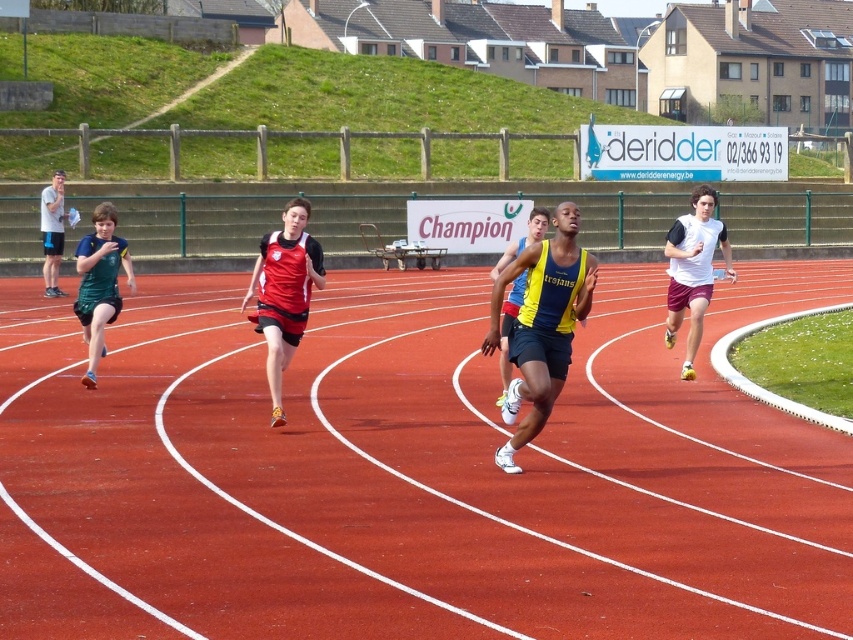
Is point (296, 314) behind point (96, 316)?

No, it is not.

Does red matte jersey at center come in front of green jersey at left?

Yes, it is in front of green jersey at left.

Where is `red matte jersey at center`? Image resolution: width=853 pixels, height=640 pixels. red matte jersey at center is located at coordinates (283, 292).

Between green jersey at left and yellow/blue athletic uniform at center, which one is positioned lower?

yellow/blue athletic uniform at center is lower down.

Which is behind, point (123, 240) or point (534, 240)?

Positioned behind is point (123, 240).

Between point (100, 289) and point (538, 216), which one is positioned in front?

Point (538, 216) is more forward.

Locate an element on the screen. The width and height of the screenshot is (853, 640). green jersey at left is located at coordinates (99, 282).

Is red rubber track at center positioned behind green jersey at left?

No, it is in front of green jersey at left.

Can you confirm if red rubber track at center is bigger than green jersey at left?

Yes, red rubber track at center is bigger than green jersey at left.

Is point (723, 573) closer to camera compared to point (96, 273)?

Yes, point (723, 573) is closer to viewer.

Identify the location of red rubber track at center. (410, 472).